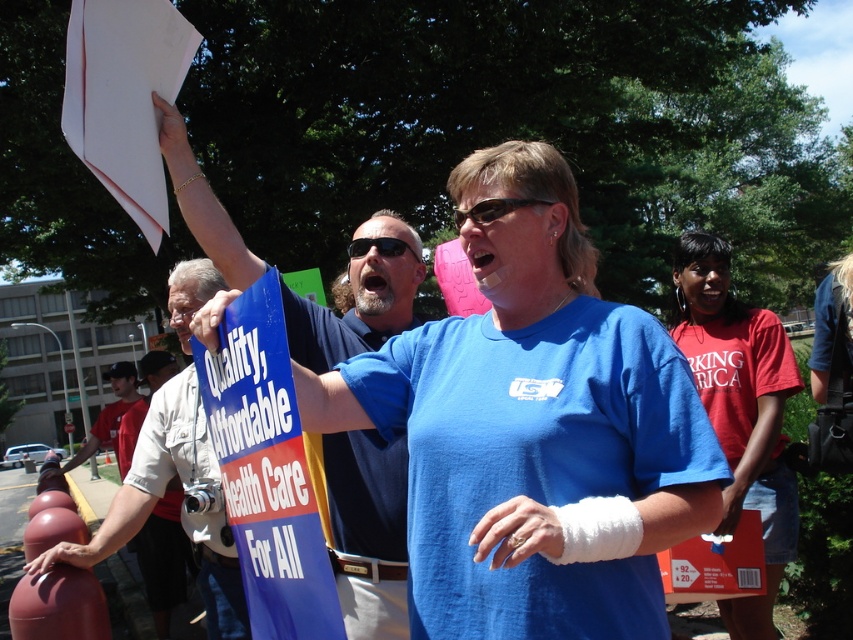
What is located at the coordinates point (364,525) in the image?

The point (364,525) is located on the blue fabric shirt at center.

Based on the scene description, which shirt is positioned higher between the white cotton shirt at center and the light beige cotton shirt at center?

The white cotton shirt at center is positioned higher than the light beige cotton shirt at center according to the description.